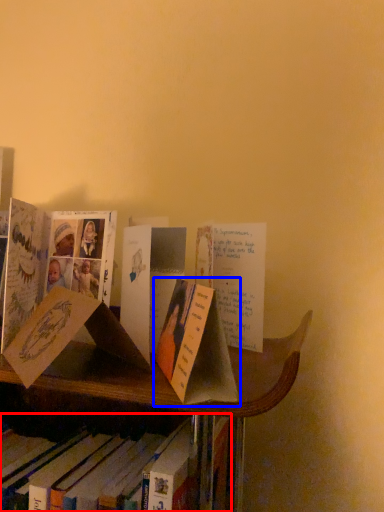
Question: Among these objects, which one is farthest to the camera, book (highlighted by a red box) or book (highlighted by a blue box)?

Choices:
 (A) book
 (B) book

Answer: (A)